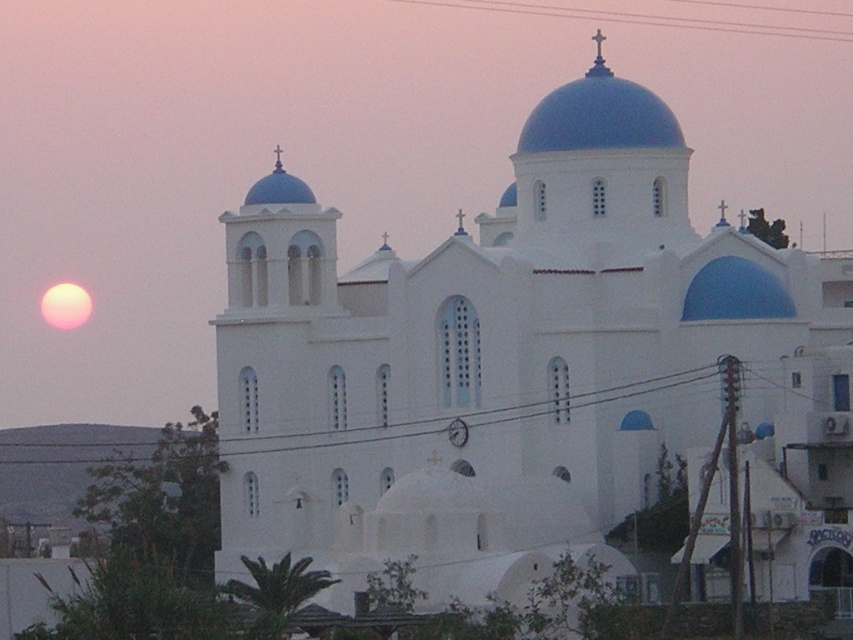
You are standing in front of the church and want to reach the point at coordinates point (555, 13). Given that the church is 100 feet wide, can you estimate how far you need to walk to reach that point?

The point at coordinates point (555, 13) is 646.41 feet away from the camera, so you would need to walk approximately 646.41 feet to reach it.

You are an electrician inspecting the wires in the church. You notice two wires, the metallic wire at upper center and the black wire at lower center. Which wire should you prioritize checking if you need to address the one closer to you first?

You should prioritize checking the metallic wire at upper center first because it is closer to you than the black wire at lower center.

You are an electrician inspecting the church structure. You notice two wires, the metallic wire at upper center and the black wire at lower center. Which wire is longer?

The black wire at lower center is longer than the metallic wire at upper center.